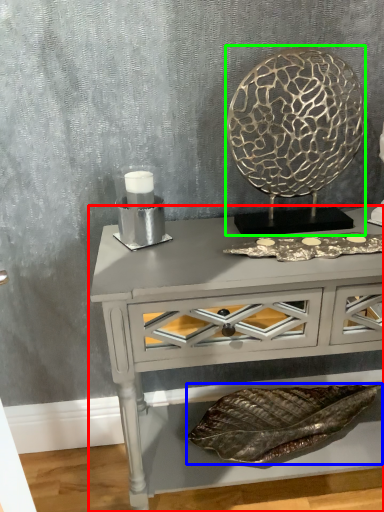
Question: Which is nearer to the table (highlighted by a red box)? material (highlighted by a blue box) or round table (highlighted by a green box).

Choices:
 (A) material
 (B) round table

Answer: (B)